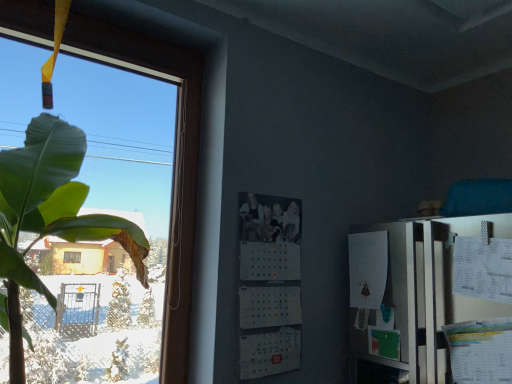
Question: Is white matte calendar at center in front of or behind transparent glass window at left in the image?

Choices:
 (A) front
 (B) behind

Answer: (B)

Question: Is point (282, 339) closer or farther from the camera than point (82, 23)?

Choices:
 (A) farther
 (B) closer

Answer: (A)

Question: From a real-world perspective, is white matte calendar at center physically located above or below transparent glass window at left?

Choices:
 (A) below
 (B) above

Answer: (A)

Question: From a real-world perspective, is transparent glass window at left positioned above or below white matte calendar at center?

Choices:
 (A) above
 (B) below

Answer: (A)

Question: From the image's perspective, is transparent glass window at left above or below white matte calendar at center?

Choices:
 (A) below
 (B) above

Answer: (B)

Question: In terms of width, does transparent glass window at left look wider or thinner when compared to white matte calendar at center?

Choices:
 (A) wide
 (B) thin

Answer: (A)

Question: Is transparent glass window at left taller or shorter than white matte calendar at center?

Choices:
 (A) tall
 (B) short

Answer: (A)